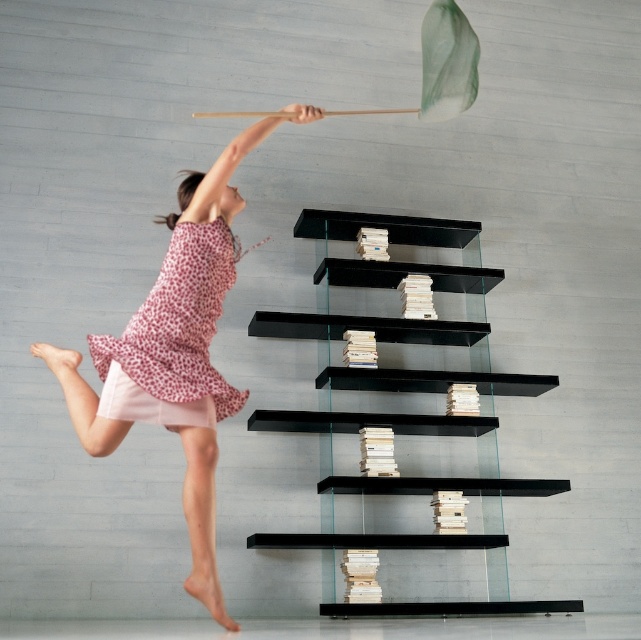
You are standing in the room and want to place a small potted plant on the black glass shelves at center. However, you need to ensure that the plant is not placed above the pink dotted dress at upper left. Can you do this?

The black glass shelves at center is below the pink dotted dress at upper left, so placing the plant on the black glass shelves at center will naturally be below the pink dotted dress at upper left. Therefore, you can safely place the plant there without violating the requirement.

You are an observer looking at the scene. There are two items mentioned in the image, the pink dotted dress at upper left and the pink dotted fabric dress at upper left. Which one is more to the left?

The pink dotted dress at upper left is more to the left.